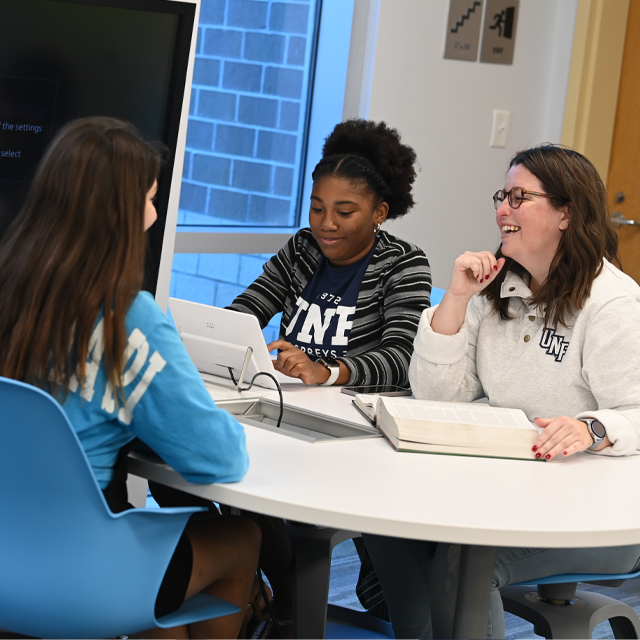
This screenshot has height=640, width=640. Find the location of `the right armrest`. the right armrest is located at coordinates (166, 509).